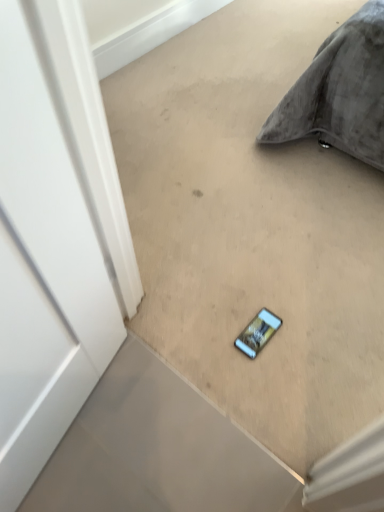
Image resolution: width=384 pixels, height=512 pixels. In order to click on metallic silver phone at center in this screenshot , I will do `click(258, 333)`.

What do you see at coordinates (258, 333) in the screenshot?
I see `metallic silver phone at center` at bounding box center [258, 333].

In order to face metallic silver phone at center, should I rotate leftwards or rightwards?

A 8.976 degree turn to the right will do.

Identify the location of metallic silver phone at center. This screenshot has height=512, width=384. (258, 333).